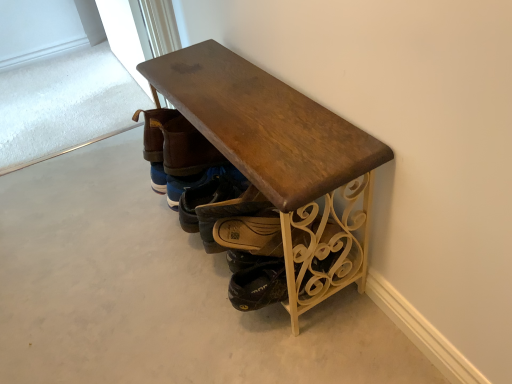
Question: Would you consider brown leather shoe at center, acting as the 2th footwear starting from the back, to be distant from brown leather shoe at center, positioned as the 2th footwear in front-to-back order?

Choices:
 (A) no
 (B) yes

Answer: (A)

Question: From a real-world perspective, is brown leather shoe at center, acting as the 2th footwear starting from the back, positioned under brown leather shoe at center, positioned as the 2th footwear in front-to-back order, based on gravity?

Choices:
 (A) no
 (B) yes

Answer: (B)

Question: From a real-world perspective, is brown leather shoe at center, acting as the 2th footwear starting from the back, on top of brown leather shoe at center, the third footwear viewed from the back?

Choices:
 (A) yes
 (B) no

Answer: (B)

Question: Is brown leather shoe at center, acting as the 3th footwear starting from the front, taller than brown leather shoe at center, the third footwear viewed from the back?

Choices:
 (A) no
 (B) yes

Answer: (B)

Question: Is brown leather shoe at center, acting as the 3th footwear starting from the front, positioned behind brown leather shoe at center, positioned as the 2th footwear in front-to-back order?

Choices:
 (A) no
 (B) yes

Answer: (B)

Question: Does brown leather shoe at center, acting as the 2th footwear starting from the back, appear on the right side of brown leather shoe at center, positioned as the 2th footwear in front-to-back order?

Choices:
 (A) no
 (B) yes

Answer: (A)

Question: Is brown leather shoes at center, acting as the first footwear starting from the front, further to the viewer compared to brown leather boot at center, arranged as the first footwear when viewed from the back?

Choices:
 (A) yes
 (B) no

Answer: (B)

Question: Is brown leather shoes at center, acting as the first footwear starting from the front, positioned in front of brown leather boot at center, arranged as the first footwear when viewed from the back?

Choices:
 (A) yes
 (B) no

Answer: (A)

Question: From the image's perspective, is brown leather shoes at center, acting as the first footwear starting from the front, located above brown leather boot at center, which is the fourth footwear in front-to-back order?

Choices:
 (A) yes
 (B) no

Answer: (B)

Question: From a real-world perspective, is brown leather shoes at center, marked as the 4th footwear in a back-to-front arrangement, below brown leather boot at center, arranged as the first footwear when viewed from the back?

Choices:
 (A) yes
 (B) no

Answer: (A)

Question: Does brown leather shoes at center, marked as the 4th footwear in a back-to-front arrangement, appear on the left side of brown leather boot at center, arranged as the first footwear when viewed from the back?

Choices:
 (A) yes
 (B) no

Answer: (B)

Question: Does brown leather shoes at center, acting as the first footwear starting from the front, appear on the right side of brown leather boot at center, arranged as the first footwear when viewed from the back?

Choices:
 (A) yes
 (B) no

Answer: (A)

Question: From a real-world perspective, is brown leather shoe at center, acting as the 3th footwear starting from the front, on top of brown leather boot at center, arranged as the first footwear when viewed from the back?

Choices:
 (A) yes
 (B) no

Answer: (B)